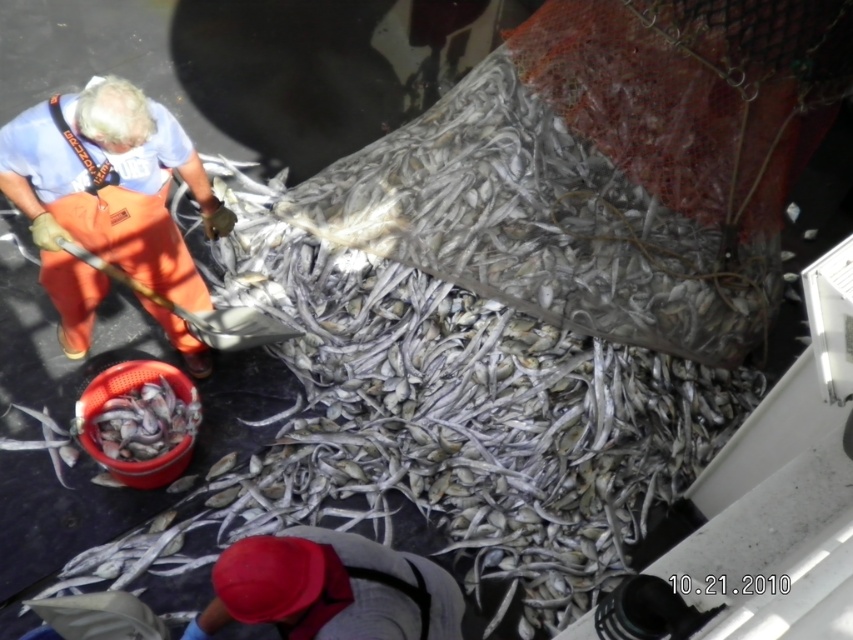
You are standing on the deck and see the gray fabric cap at lower center and the silvery metallic fish at lower left. Which object is closer to the ground?

The gray fabric cap at lower center is below the silvery metallic fish at lower left, so it is closer to the ground.

You are standing on the deck and want to hand a tool to the orange fabric worker at left and the silvery metallic fish at lower left. Which one will you reach first?

The orange fabric worker at left will be reached first because they are closer to the viewer than the silvery metallic fish at lower left.

You are standing on the deck and see the gray fabric cap at lower center and the silvery metallic fish at lower left. Which object is positioned to the right of the other?

The gray fabric cap at lower center is to the right of silvery metallic fish at lower left.